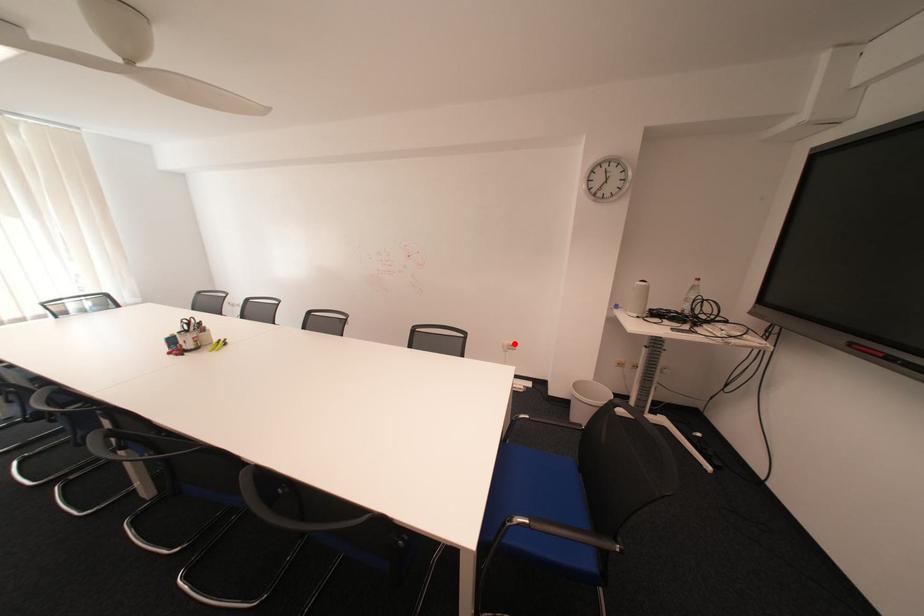
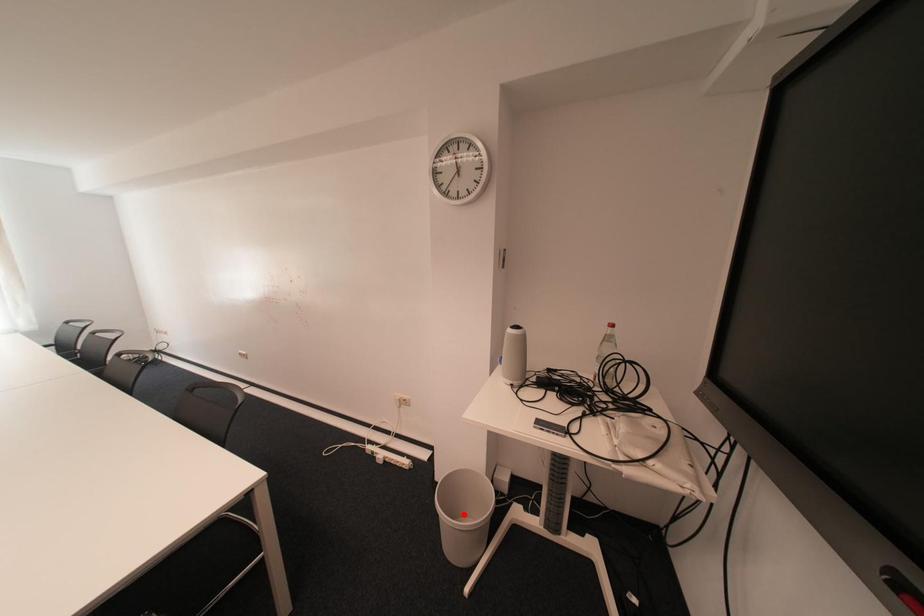
I am providing you with two images of the same scene from different viewpoints. A red point is marked on the first image and another point is marked on the second image. Is the red point in image1 aligned with the point shown in image2?

No